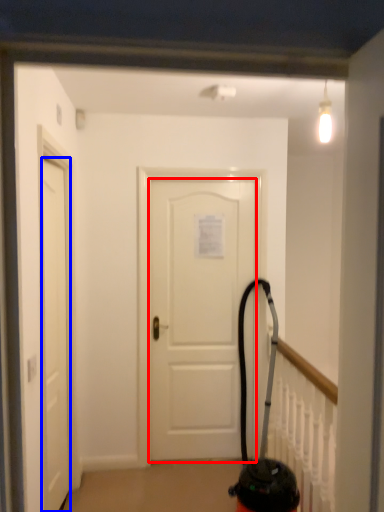
Question: Which point is closer to the camera, door (highlighted by a red box) or door (highlighted by a blue box)?

Choices:
 (A) door
 (B) door

Answer: (B)